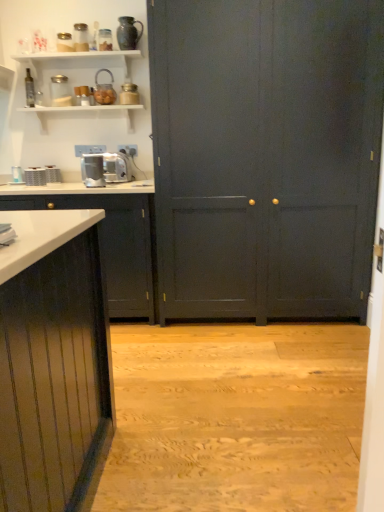
At what (x,y) coordinates should I click in order to perform the action: click on clear glass jar at upper left, the 4th appliance from the right. Please return your answer as a coordinate pair (x, y). The height and width of the screenshot is (512, 384). Looking at the image, I should click on (x=60, y=91).

What do you see at coordinates (129, 94) in the screenshot? I see `metallic silver toaster at upper center, which is counted as the seventh appliance, starting from the left` at bounding box center [129, 94].

What do you see at coordinates (17, 174) in the screenshot? I see `brushed metal toaster at left, the 1th appliance in the left-to-right sequence` at bounding box center [17, 174].

Where is `matte dark gray cupboard at center`? The height and width of the screenshot is (512, 384). matte dark gray cupboard at center is located at coordinates (265, 155).

Is metallic silver toaster at left, which ranks as the 3th appliance in left-to-right order, next to matte glass teapot at upper center, which appears as the third appliance when viewed from the right?

No, metallic silver toaster at left, which ranks as the 3th appliance in left-to-right order, is not with matte glass teapot at upper center, which appears as the third appliance when viewed from the right.

Between metallic silver toaster at left, arranged as the 5th appliance when viewed from the right, and matte glass teapot at upper center, the fifth appliance positioned from the left, which one has larger width?

matte glass teapot at upper center, the fifth appliance positioned from the left, is wider.

Find the location of a particular element. This screenshot has height=512, width=384. the 6th appliance above the metallic silver toaster at left, which ranks as the 3th appliance in left-to-right order (from a real-world perspective) is located at coordinates (104, 90).

From the image's perspective, does metallic silver toaster at left, arranged as the 5th appliance when viewed from the right, appear lower than matte glass teapot at upper center, the fifth appliance positioned from the left?

Yes, from the image's perspective, metallic silver toaster at left, arranged as the 5th appliance when viewed from the right, is beneath matte glass teapot at upper center, the fifth appliance positioned from the left.

Is clear glass jar at upper left, the 4th appliance from the right, closer to camera compared to matte glass teapot at upper center, which appears as the third appliance when viewed from the right?

No, clear glass jar at upper left, the 4th appliance from the right, is behind matte glass teapot at upper center, which appears as the third appliance when viewed from the right.

Is clear glass jar at upper left, which ranks as the fourth appliance in left-to-right order, next to matte glass teapot at upper center, which appears as the third appliance when viewed from the right?

clear glass jar at upper left, which ranks as the fourth appliance in left-to-right order, and matte glass teapot at upper center, which appears as the third appliance when viewed from the right, are not in contact.

Is clear glass jar at upper left, the 4th appliance from the right, facing towards matte glass teapot at upper center, the fifth appliance positioned from the left?

No, clear glass jar at upper left, the 4th appliance from the right, is not aimed at matte glass teapot at upper center, the fifth appliance positioned from the left.

In the scene shown: Visually, is clear glass jar at upper left, the 4th appliance from the right, positioned to the left or to the right of matte glass teapot at upper center, which appears as the third appliance when viewed from the right?

Clearly, clear glass jar at upper left, the 4th appliance from the right, is on the left of matte glass teapot at upper center, which appears as the third appliance when viewed from the right, in the image.

In the scene shown: From a real-world perspective, who is located lower, brushed metal toaster at left, the 7th appliance when ordered from right to left, or metallic silver toaster at upper center, which is counted as the seventh appliance, starting from the left?

In real-world perspective, brushed metal toaster at left, the 7th appliance when ordered from right to left, is lower.

Locate an element on the screen. This screenshot has width=384, height=512. the 2nd appliance directly above the brushed metal toaster at left, the 7th appliance when ordered from right to left (from a real-world perspective) is located at coordinates (129, 94).

Considering the relative sizes of brushed metal toaster at left, the 1th appliance in the left-to-right sequence, and metallic silver toaster at upper center, which ranks as the 1th appliance in right-to-left order, in the image provided, is brushed metal toaster at left, the 1th appliance in the left-to-right sequence, taller than metallic silver toaster at upper center, which ranks as the 1th appliance in right-to-left order,?

In fact, brushed metal toaster at left, the 1th appliance in the left-to-right sequence, may be shorter than metallic silver toaster at upper center, which ranks as the 1th appliance in right-to-left order.

Is metallic silver toaster at upper center, which ranks as the 1th appliance in right-to-left order, at the back of brushed metal toaster at left, the 1th appliance in the left-to-right sequence?

brushed metal toaster at left, the 1th appliance in the left-to-right sequence, does not have its back to metallic silver toaster at upper center, which ranks as the 1th appliance in right-to-left order.

What's the angular difference between brushed metal toaster at left, positioned as the second appliance in left-to-right order, and metallic silver toaster at left, which ranks as the 3th appliance in left-to-right order,'s facing directions?

The angle between the facing direction of brushed metal toaster at left, positioned as the second appliance in left-to-right order, and the facing direction of metallic silver toaster at left, which ranks as the 3th appliance in left-to-right order, is 1.57 degrees.

Which object is further away from the camera, brushed metal toaster at left, which is the sixth appliance in right-to-left order, or metallic silver toaster at left, which ranks as the 3th appliance in left-to-right order?

metallic silver toaster at left, which ranks as the 3th appliance in left-to-right order, is further away from the camera.

Is brushed metal toaster at left, which is the sixth appliance in right-to-left order, inside the boundaries of metallic silver toaster at left, arranged as the 5th appliance when viewed from the right, or outside?

brushed metal toaster at left, which is the sixth appliance in right-to-left order, lies outside metallic silver toaster at left, arranged as the 5th appliance when viewed from the right.

Identify the location of the 2nd appliance below the metallic silver toaster at left, which ranks as the 3th appliance in left-to-right order (from the image's perspective). (35, 176).

Which of these two, brushed metal toaster at left, which is the sixth appliance in right-to-left order, or clear glass jar at upper left, the 4th appliance from the right, is bigger?

With larger size is clear glass jar at upper left, the 4th appliance from the right.

How distant is brushed metal toaster at left, positioned as the second appliance in left-to-right order, from clear glass jar at upper left, the 4th appliance from the right?

A distance of 22.60 inches exists between brushed metal toaster at left, positioned as the second appliance in left-to-right order, and clear glass jar at upper left, the 4th appliance from the right.

Which object is positioned more to the right, brushed metal toaster at left, which is the sixth appliance in right-to-left order, or clear glass jar at upper left, the 4th appliance from the right?

clear glass jar at upper left, the 4th appliance from the right.

Does brushed metal toaster at left, which is the sixth appliance in right-to-left order, contain clear glass jar at upper left, the 4th appliance from the right?

That's incorrect, clear glass jar at upper left, the 4th appliance from the right, is not inside brushed metal toaster at left, which is the sixth appliance in right-to-left order.

Which object is closer to the camera taking this photo, satin silver toaster at center, the sixth appliance viewed from the left, or white glossy countertop at left?

white glossy countertop at left is closer to the camera.

From the image's perspective, is satin silver toaster at center, which ranks as the 2th appliance in right-to-left order, on white glossy countertop at left?

Yes.

From a real-world perspective, does satin silver toaster at center, which ranks as the 2th appliance in right-to-left order, stand above white glossy countertop at left?

Yes, from a real-world perspective, satin silver toaster at center, which ranks as the 2th appliance in right-to-left order, is on top of white glossy countertop at left.

Can white glossy countertop at left be found inside satin silver toaster at center, the sixth appliance viewed from the left?

No, white glossy countertop at left is not surrounded by satin silver toaster at center, the sixth appliance viewed from the left.

Which object is positioned more to the right, brushed metal toaster at left, which is the sixth appliance in right-to-left order, or brushed metal toaster at left, the 1th appliance in the left-to-right sequence?

brushed metal toaster at left, which is the sixth appliance in right-to-left order.

Measure the distance from brushed metal toaster at left, positioned as the second appliance in left-to-right order, to brushed metal toaster at left, the 1th appliance in the left-to-right sequence.

A distance of 3.51 inches exists between brushed metal toaster at left, positioned as the second appliance in left-to-right order, and brushed metal toaster at left, the 1th appliance in the left-to-right sequence.

How different are the orientations of brushed metal toaster at left, positioned as the second appliance in left-to-right order, and brushed metal toaster at left, the 1th appliance in the left-to-right sequence, in degrees?

brushed metal toaster at left, positioned as the second appliance in left-to-right order, and brushed metal toaster at left, the 1th appliance in the left-to-right sequence, are facing 0.375 degrees away from each other.

Image resolution: width=384 pixels, height=512 pixels. Find the location of `appliance that is the 4th object located below the matte glass teapot at upper center, the fifth appliance positioned from the left (from the image's perspective)`. appliance that is the 4th object located below the matte glass teapot at upper center, the fifth appliance positioned from the left (from the image's perspective) is located at coordinates (53, 174).

Starting from the matte glass teapot at upper center, which appears as the third appliance when viewed from the right, which appliance is the 1st one to the left? Please provide its 2D coordinates.

[(60, 91)]

Looking at this image, which object lies further to the anchor point matte dark gray cupboard at center, matte glass teapot at upper center, the fifth appliance positioned from the left, or white glossy countertop at left?

matte glass teapot at upper center, the fifth appliance positioned from the left, lies further to matte dark gray cupboard at center than the other object.

Considering their positions, is metallic silver toaster at left, arranged as the 5th appliance when viewed from the right, positioned closer to satin silver toaster at center, the sixth appliance viewed from the left, than clear glass jar at upper left, which ranks as the fourth appliance in left-to-right order?

Based on the image, metallic silver toaster at left, arranged as the 5th appliance when viewed from the right, appears to be nearer to satin silver toaster at center, the sixth appliance viewed from the left.

Estimate the real-world distances between objects in this image. Which object is further from satin silver toaster at center, the sixth appliance viewed from the left, matte dark gray cupboard at center or brushed metal toaster at left, positioned as the second appliance in left-to-right order?

Based on the image, matte dark gray cupboard at center appears to be further to satin silver toaster at center, the sixth appliance viewed from the left.

Looking at the image, which one is located closer to metallic silver toaster at left, arranged as the 5th appliance when viewed from the right, brushed metal toaster at left, the 7th appliance when ordered from right to left, or white glossy countertop at left?

Based on the image, brushed metal toaster at left, the 7th appliance when ordered from right to left, appears to be nearer to metallic silver toaster at left, arranged as the 5th appliance when viewed from the right.

Based on their spatial positions, is brushed metal toaster at left, the 1th appliance in the left-to-right sequence, or matte dark gray cupboard at center closer to matte glass teapot at upper center, which appears as the third appliance when viewed from the right?

Among the two, brushed metal toaster at left, the 1th appliance in the left-to-right sequence, is located nearer to matte glass teapot at upper center, which appears as the third appliance when viewed from the right.

When comparing their distances from metallic silver toaster at left, which ranks as the 3th appliance in left-to-right order, does metallic silver toaster at upper center, which ranks as the 1th appliance in right-to-left order, or brushed metal toaster at left, the 1th appliance in the left-to-right sequence, seem closer?

brushed metal toaster at left, the 1th appliance in the left-to-right sequence, lies closer to metallic silver toaster at left, which ranks as the 3th appliance in left-to-right order, than the other object.

Estimate the real-world distances between objects in this image. Which object is further from brushed metal toaster at left, positioned as the second appliance in left-to-right order, matte glass teapot at upper center, the fifth appliance positioned from the left, or satin silver toaster at center, which ranks as the 2th appliance in right-to-left order?

Among the two, matte glass teapot at upper center, the fifth appliance positioned from the left, is located further to brushed metal toaster at left, positioned as the second appliance in left-to-right order.

When comparing their distances from brushed metal toaster at left, positioned as the second appliance in left-to-right order, does matte glass teapot at upper center, the fifth appliance positioned from the left, or brushed metal toaster at left, the 7th appliance when ordered from right to left, seem further?

matte glass teapot at upper center, the fifth appliance positioned from the left.

The height and width of the screenshot is (512, 384). Identify the location of appliance between satin silver toaster at center, the sixth appliance viewed from the left, and white glossy countertop at left in the up-down direction. (35, 176).

This screenshot has height=512, width=384. Identify the location of appliance between satin silver toaster at center, the sixth appliance viewed from the left, and matte dark gray cupboard at center. (129, 94).

Where is `cabinetry situated between brushed metal toaster at left, the 7th appliance when ordered from right to left, and satin silver toaster at center, the sixth appliance viewed from the left, from left to right`? Image resolution: width=384 pixels, height=512 pixels. cabinetry situated between brushed metal toaster at left, the 7th appliance when ordered from right to left, and satin silver toaster at center, the sixth appliance viewed from the left, from left to right is located at coordinates [x=114, y=244].

This screenshot has width=384, height=512. Find the location of `cabinetry between clear glass jar at upper left, which ranks as the fourth appliance in left-to-right order, and matte dark gray cupboard at center from left to right`. cabinetry between clear glass jar at upper left, which ranks as the fourth appliance in left-to-right order, and matte dark gray cupboard at center from left to right is located at coordinates (114, 244).